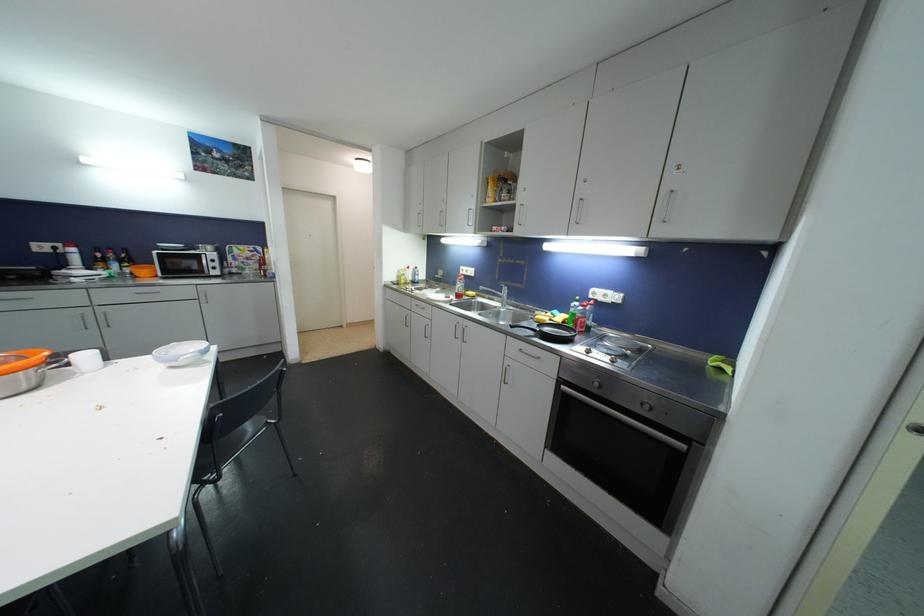
Describe the element at coordinates (612, 414) in the screenshot. This screenshot has width=924, height=616. I see `a oven door handle` at that location.